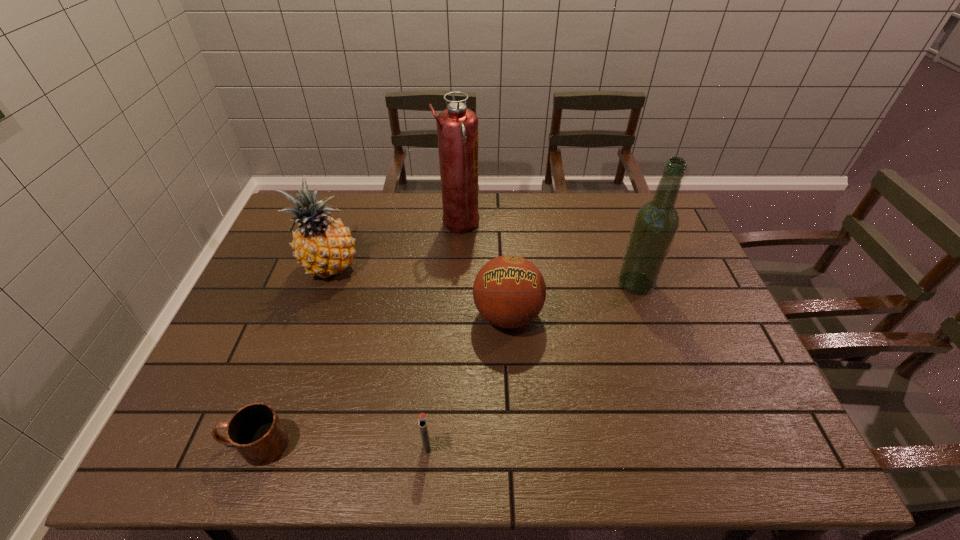
Locate an element on the screen. fire extinguisher is located at coordinates (457, 126).

The height and width of the screenshot is (540, 960). What are the coordinates of `liquor` in the screenshot? It's located at (656, 223).

Find the location of `the fourth shortest object`. the fourth shortest object is located at coordinates (323, 246).

This screenshot has height=540, width=960. Identify the location of the third shortest object. (509, 291).

Image resolution: width=960 pixels, height=540 pixels. I want to click on igniter, so [422, 420].

The width and height of the screenshot is (960, 540). In order to click on the shortest object in this screenshot , I will do `click(255, 430)`.

I want to click on free space located on the side of the farthest object with the label, so click(509, 225).

Locate an element on the screen. free space located on the left of the liquor is located at coordinates (533, 283).

Find the location of a particular element. free space located 0.360m on the right of the pineapple is located at coordinates (478, 267).

The image size is (960, 540). What are the coordinates of `vacant space located on the left of the fourth tallest object` in the screenshot? It's located at (335, 315).